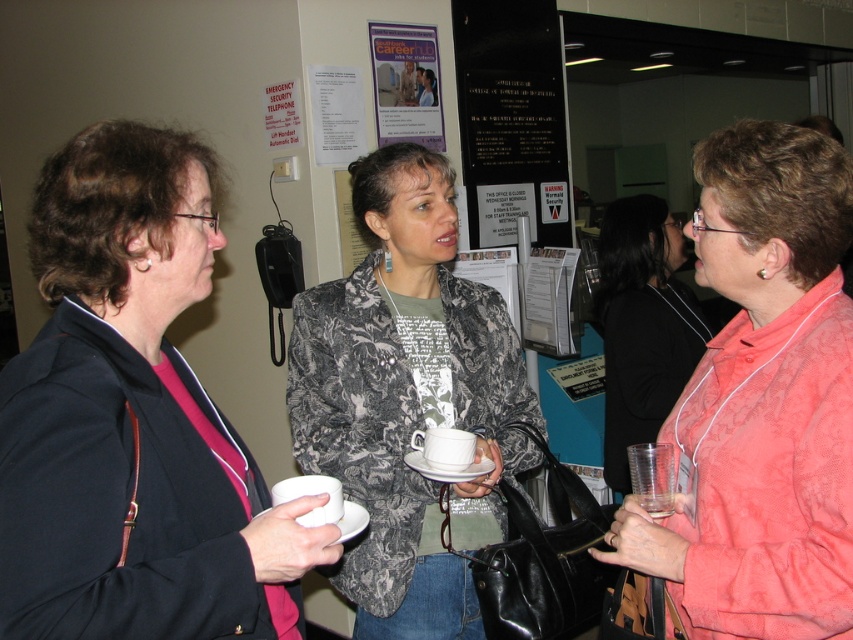
Question: Which of the following is the closest to the observer?

Choices:
 (A) (415, 88)
 (B) (73, 584)

Answer: (B)

Question: Does floral-patterned blazer at center have a lesser width compared to white glossy poster at upper center?

Choices:
 (A) no
 (B) yes

Answer: (A)

Question: Which object is closer to the camera taking this photo?

Choices:
 (A) translucent plastic cup at right
 (B) pink satin blouse at right
 (C) floral-patterned blazer at center

Answer: (B)

Question: Does white paper at upper center have a smaller size compared to white paper poster at upper left?

Choices:
 (A) yes
 (B) no

Answer: (B)

Question: Can you confirm if translucent plastic cup at right is positioned to the left of clear plastic cup at lower right?

Choices:
 (A) yes
 (B) no

Answer: (B)

Question: Which of the following is the farthest from the observer?

Choices:
 (A) [x=732, y=365]
 (B) [x=360, y=116]
 (C) [x=625, y=378]
 (D) [x=292, y=134]

Answer: (B)